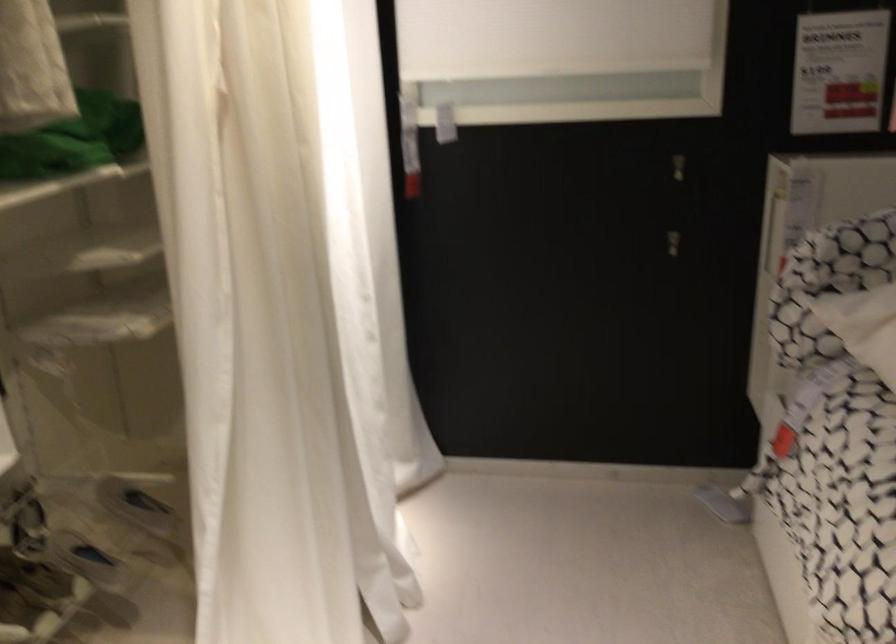
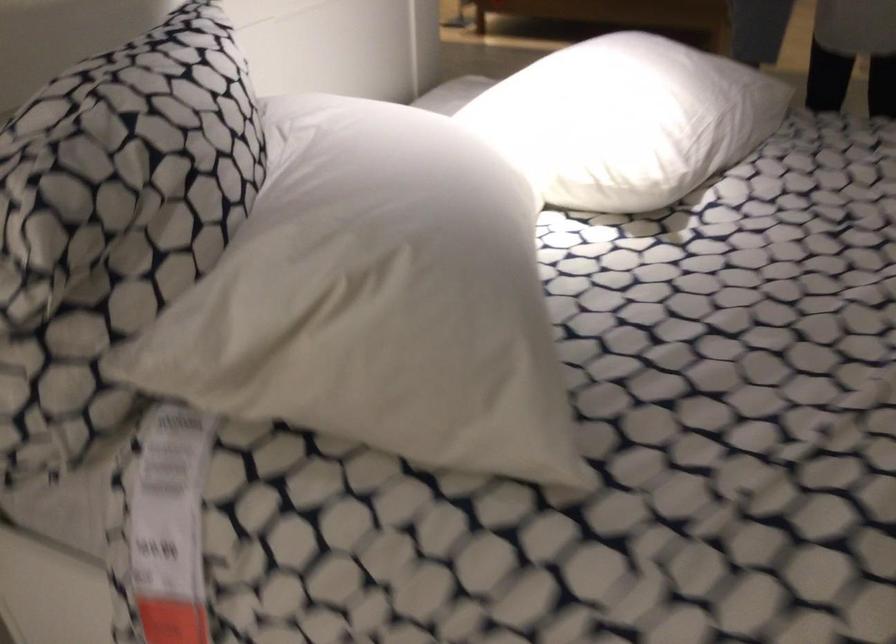
Find the pixel in the second image that matches [805,398] in the first image.

(169, 526)